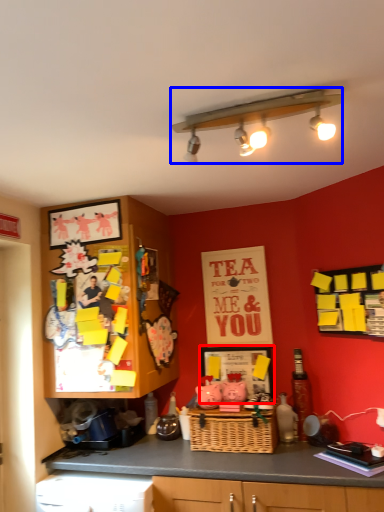
Question: Which of the following is the closest to the observer, picture frame (highlighted by a red box) or light fixture (highlighted by a blue box)?

Choices:
 (A) picture frame
 (B) light fixture

Answer: (B)